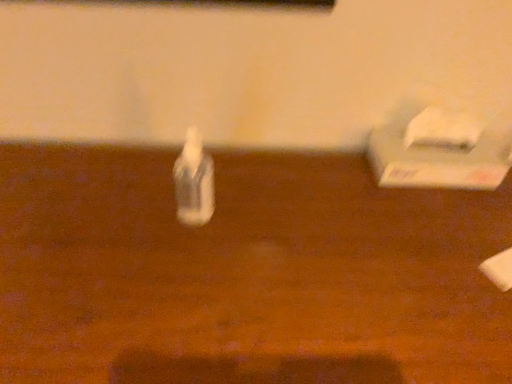
Question: Is wooden table at center surrounded by white matte tissue box at right?

Choices:
 (A) no
 (B) yes

Answer: (A)

Question: Is white matte tissue box at right bigger than wooden table at center?

Choices:
 (A) no
 (B) yes

Answer: (A)

Question: Does white matte tissue box at right have a greater width compared to wooden table at center?

Choices:
 (A) yes
 (B) no

Answer: (B)

Question: Can we say white matte tissue box at right lies outside wooden table at center?

Choices:
 (A) no
 (B) yes

Answer: (B)

Question: Is white matte tissue box at right with wooden table at center?

Choices:
 (A) no
 (B) yes

Answer: (A)

Question: Does point (435, 119) appear closer or farther from the camera than point (185, 190)?

Choices:
 (A) farther
 (B) closer

Answer: (A)

Question: Is white matte tissue box at right bigger or smaller than transparent plastic bottle at center?

Choices:
 (A) small
 (B) big

Answer: (B)

Question: From a real-world perspective, is white matte tissue box at right physically located above or below transparent plastic bottle at center?

Choices:
 (A) above
 (B) below

Answer: (B)

Question: From the image's perspective, relative to transparent plastic bottle at center, is white matte tissue box at right above or below?

Choices:
 (A) above
 (B) below

Answer: (A)

Question: Is transparent plastic bottle at center bigger or smaller than wooden table at center?

Choices:
 (A) small
 (B) big

Answer: (A)

Question: Considering their positions, is transparent plastic bottle at center located in front of or behind wooden table at center?

Choices:
 (A) behind
 (B) front

Answer: (A)

Question: In terms of height, does transparent plastic bottle at center look taller or shorter compared to wooden table at center?

Choices:
 (A) tall
 (B) short

Answer: (B)

Question: Based on their positions, is transparent plastic bottle at center located to the left or right of wooden table at center?

Choices:
 (A) left
 (B) right

Answer: (B)

Question: In the image, is wooden table at center positioned in front of or behind white matte tissue box at right?

Choices:
 (A) front
 (B) behind

Answer: (A)

Question: Considering the relative positions of wooden table at center and white matte tissue box at right in the image provided, is wooden table at center to the left or to the right of white matte tissue box at right?

Choices:
 (A) right
 (B) left

Answer: (B)